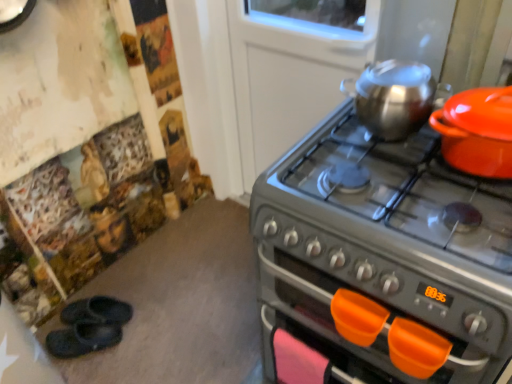
Find the location of a particular element. empty space that is ontop of matte orange pot at right, positioned as the 2th kitchen appliance in left-to-right order is located at coordinates (489, 99).